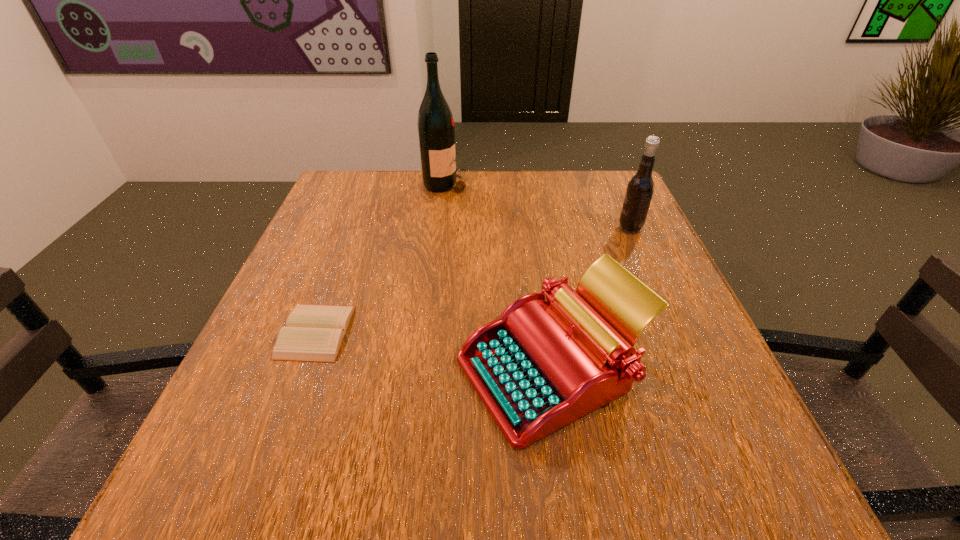
Where is `free space between the shortest object and the typewriter`? The width and height of the screenshot is (960, 540). free space between the shortest object and the typewriter is located at coordinates (434, 350).

Find the location of `empty space between the tallest object and the rightmost object`. empty space between the tallest object and the rightmost object is located at coordinates (538, 206).

Identify the location of empty space between the typewriter and the leftmost object. click(434, 350).

At what (x,y) coordinates should I click in order to perform the action: click on blank region between the tallest object and the shortest object. Please return your answer as a coordinate pair (x, y). This screenshot has height=540, width=960. Looking at the image, I should click on (380, 258).

Locate an element on the screen. This screenshot has height=540, width=960. free spot between the rightmost object and the tallest object is located at coordinates (538, 206).

In order to click on object identified as the closest to the shortest object in this screenshot , I will do `click(540, 366)`.

Select which object is the third closest to the second tallest object. Please provide its 2D coordinates. Your answer should be formatted as a tuple, i.e. [(x, y)], where the tuple contains the x and y coordinates of a point satisfying the conditions above.

[(314, 333)]

Where is `free space that satisfies the following two spatial constraints: 1. on the label of the root beer; 2. on the front side of the shortest object`? free space that satisfies the following two spatial constraints: 1. on the label of the root beer; 2. on the front side of the shortest object is located at coordinates (676, 332).